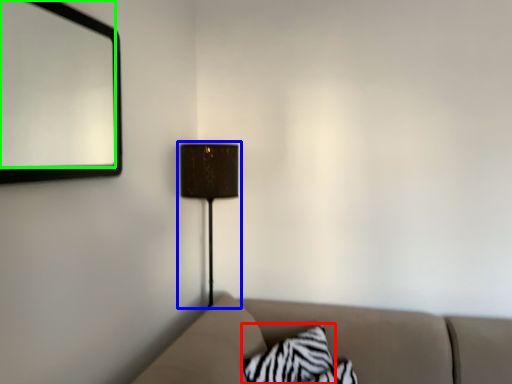
Question: Which object is positioned closest to pillow (highlighted by a red box)? Select from lamp (highlighted by a blue box) and mirror (highlighted by a green box).

Choices:
 (A) lamp
 (B) mirror

Answer: (A)